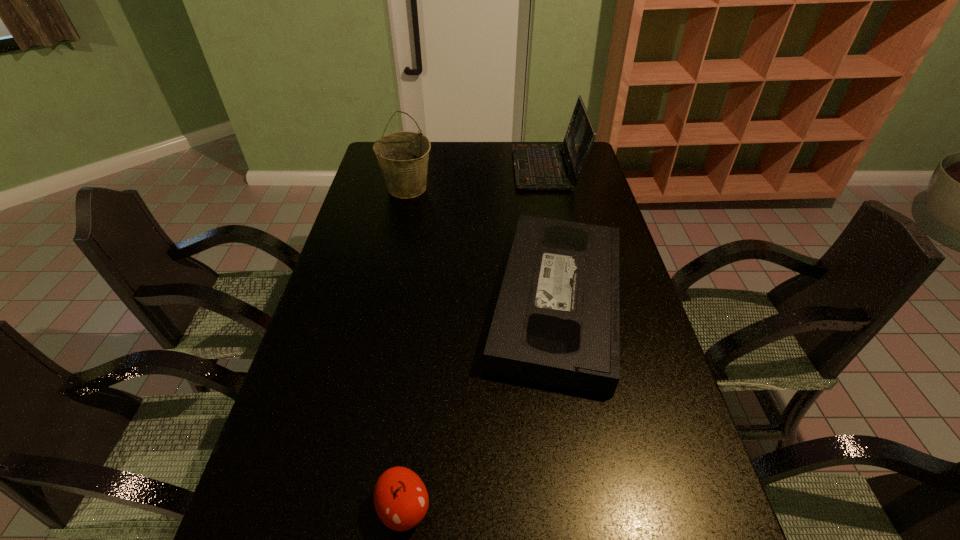
This screenshot has width=960, height=540. I want to click on wine bucket, so click(403, 157).

At what (x,y) coordinates should I click in order to perform the action: click on the second tallest object. Please return your answer as a coordinate pair (x, y). This screenshot has width=960, height=540. Looking at the image, I should click on (537, 167).

Locate an element on the screen. The image size is (960, 540). the third tallest object is located at coordinates (401, 501).

Locate an element on the screen. Image resolution: width=960 pixels, height=540 pixels. apple is located at coordinates (401, 501).

In order to click on the shortest object in this screenshot , I will do `click(556, 322)`.

I want to click on the second nearest object, so click(x=556, y=322).

I want to click on vacant space situated 0.310m on the front of the tallest object, so click(392, 262).

Where is `free space located 0.350m on the screen of the laptop computer`? This screenshot has height=540, width=960. free space located 0.350m on the screen of the laptop computer is located at coordinates (426, 168).

This screenshot has width=960, height=540. What are the coordinates of `vacant region located on the screen of the laptop computer` in the screenshot? It's located at (454, 168).

You are a GUI agent. You are given a task and a screenshot of the screen. Output one action in this format:
    pyautogui.click(x=<x>, y=<y>)
    Task: Click on the vacant area located on the screen of the laptop computer
    The image size is (960, 540).
    Given the screenshot: What is the action you would take?
    pyautogui.click(x=489, y=168)